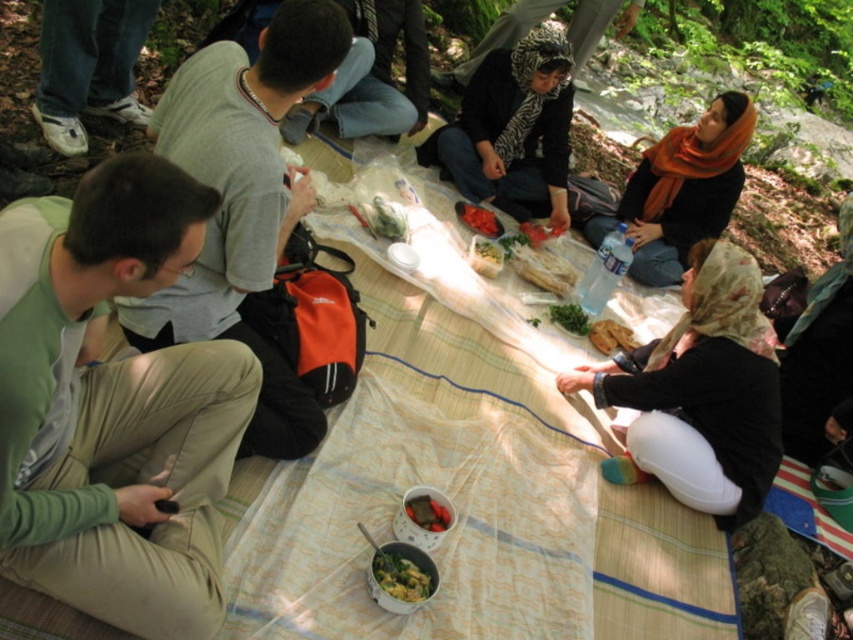
You are standing at the edge of the picnic blanket and want to pick up an item from the blanket. You see two points marked on the blanket. Which point is closer to you, point (x=393, y=579) or point (x=490, y=227)?

Point (x=393, y=579) is closer to the viewer than point (x=490, y=227), so you should reach for that one first.

You are planning to place a new item on the picnic blanket. The picnic blanket is a rectangle with its corners at coordinates 0,0 to 1,1. Where should you place the item so that it is exactly to the right of the green matte bowl at center?

The green matte bowl at center is located at coordinates (x=401, y=577). To place an item exactly to the right of it, you should position it at a coordinate slightly higher than 0.902 on the x axis, maintaining the same y coordinate of 0.471.